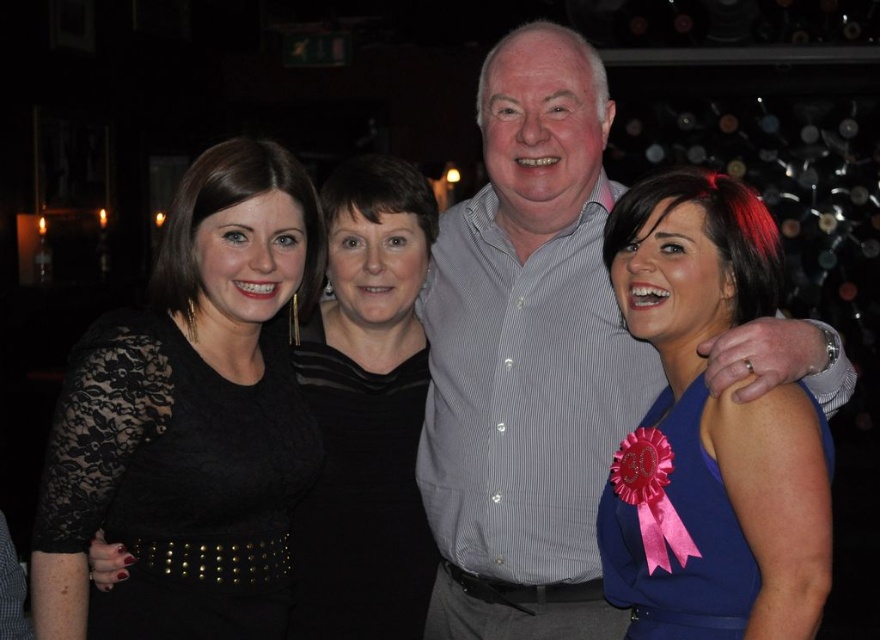
Question: Does gray striped shirt at center appear on the right side of blue satin dress at center?

Choices:
 (A) yes
 (B) no

Answer: (B)

Question: Which point is farther to the camera?

Choices:
 (A) blue satin dress at center
 (B) gray striped shirt at center
 (C) lace fabric dress at left

Answer: (B)

Question: Estimate the real-world distances between objects in this image. Which object is farther from the blue satin dress at center?

Choices:
 (A) gray striped shirt at center
 (B) lace fabric dress at left

Answer: (B)

Question: Considering the relative positions of lace fabric dress at left and black lace dress at center in the image provided, where is lace fabric dress at left located with respect to black lace dress at center?

Choices:
 (A) left
 (B) right

Answer: (A)

Question: Can you confirm if gray striped shirt at center is bigger than black lace dress at center?

Choices:
 (A) yes
 (B) no

Answer: (A)

Question: Which point is farther to the camera?

Choices:
 (A) black lace dress at center
 (B) lace fabric dress at left
 (C) gray striped shirt at center
 (D) blue satin dress at center

Answer: (A)